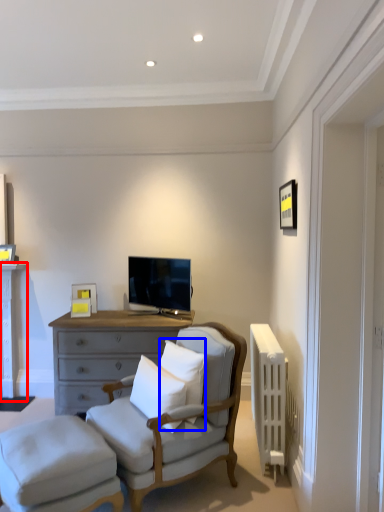
Question: Which point is further to the camera, table (highlighted by a red box) or pillow (highlighted by a blue box)?

Choices:
 (A) table
 (B) pillow

Answer: (A)